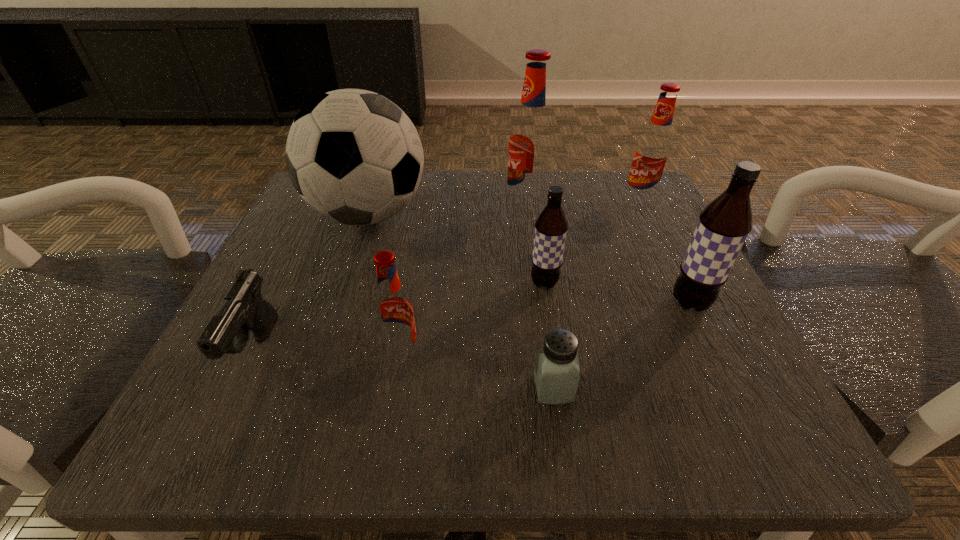
What are the coordinates of `vacant region that satisfies the following two spatial constraints: 1. on the main logo of the soccer ball; 2. at the barrel of the pistol` in the screenshot? It's located at (323, 350).